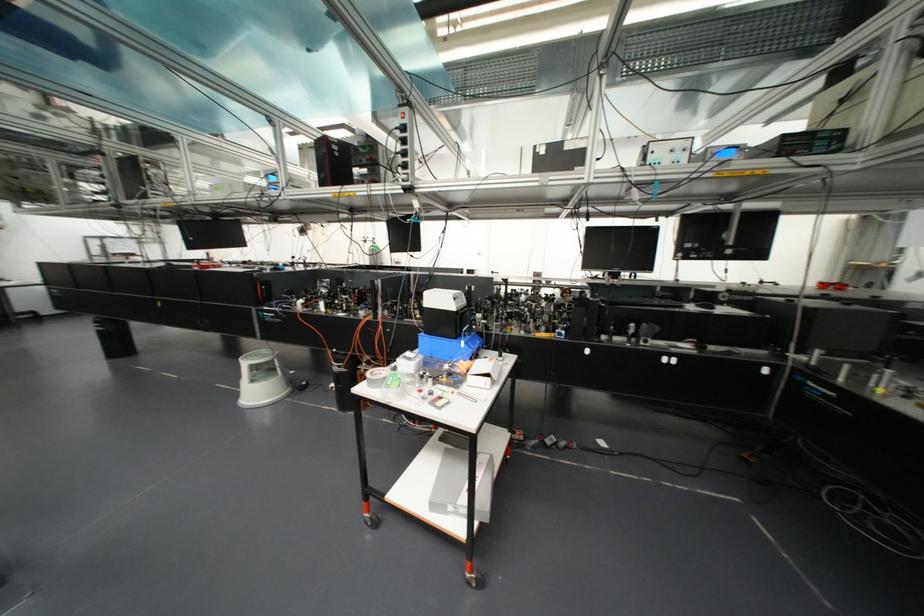
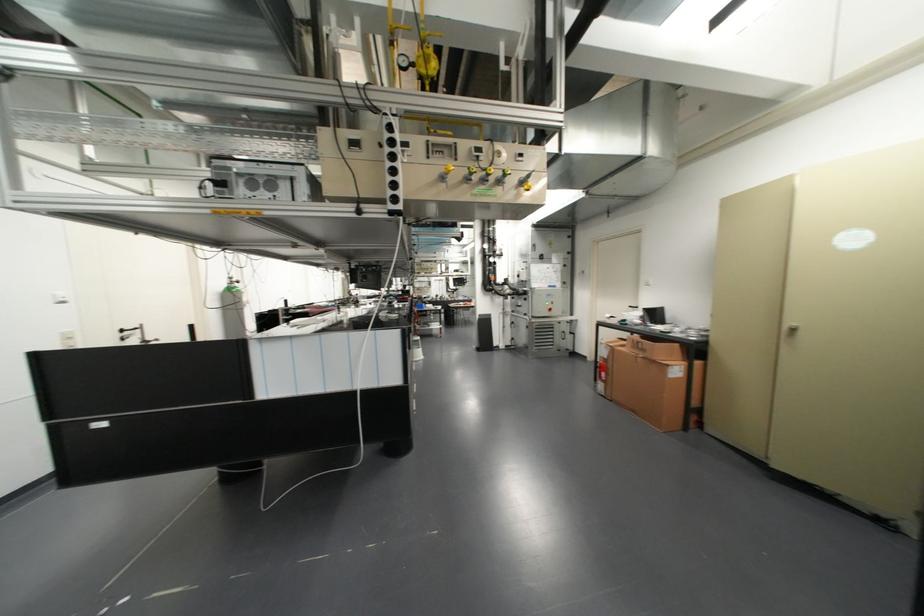
Question: I am providing you with two images of the same scene from different viewpoints. Which of the following objects are not visible in image2?

Choices:
 (A) glass carafe handle
 (B) computer mouse
 (C) large cardboard box
 (D) yellow control knob

Answer: (B)